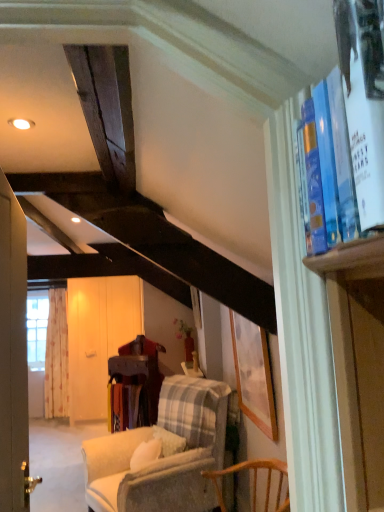
Question: Considering their positions, is matte wooden picture frame at center located in front of or behind light beige fabric curtain at left?

Choices:
 (A) front
 (B) behind

Answer: (A)

Question: In terms of height, does matte wooden picture frame at center look taller or shorter compared to light beige fabric curtain at left?

Choices:
 (A) short
 (B) tall

Answer: (A)

Question: Which object is positioned farthest from the blue hardcover book at upper right?

Choices:
 (A) light beige fabric curtain at left
 (B) white wood screen door at center
 (C) matte wooden picture frame at center
 (D) plaid fabric chair at center

Answer: (A)

Question: Which is nearer to the plaid fabric chair at center?

Choices:
 (A) light beige fabric curtain at left
 (B) matte wooden picture frame at center
 (C) blue hardcover book at upper right
 (D) white wood screen door at center

Answer: (B)